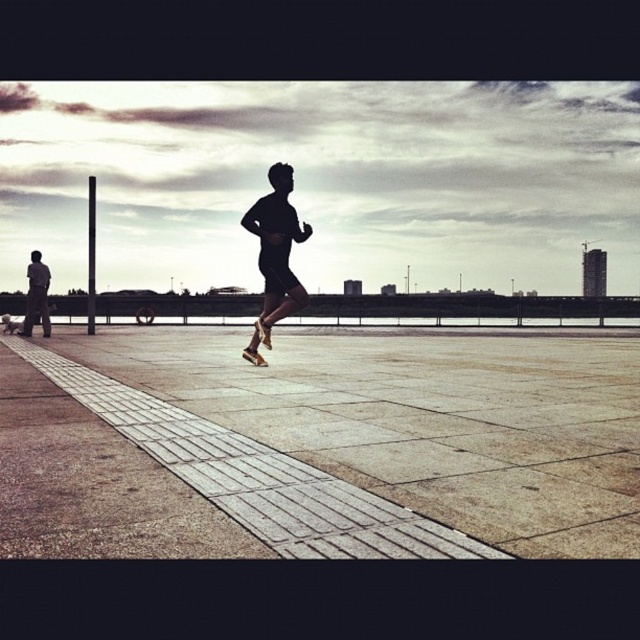
From the picture: You are standing at the bottom left corner of the image and want to walk to the gray concrete pavement at center. In which direction should you head?

The gray concrete pavement at center is located at point (324, 444), so you should head towards the center right direction from the bottom left corner.

You are standing at the bottom left corner of the paved area. You want to walk straight towards the gray concrete pavement at center. In which direction should you head?

The gray concrete pavement at center is located at point (324, 444). Since you are at the bottom left corner, you should head towards the northeast direction to reach it.